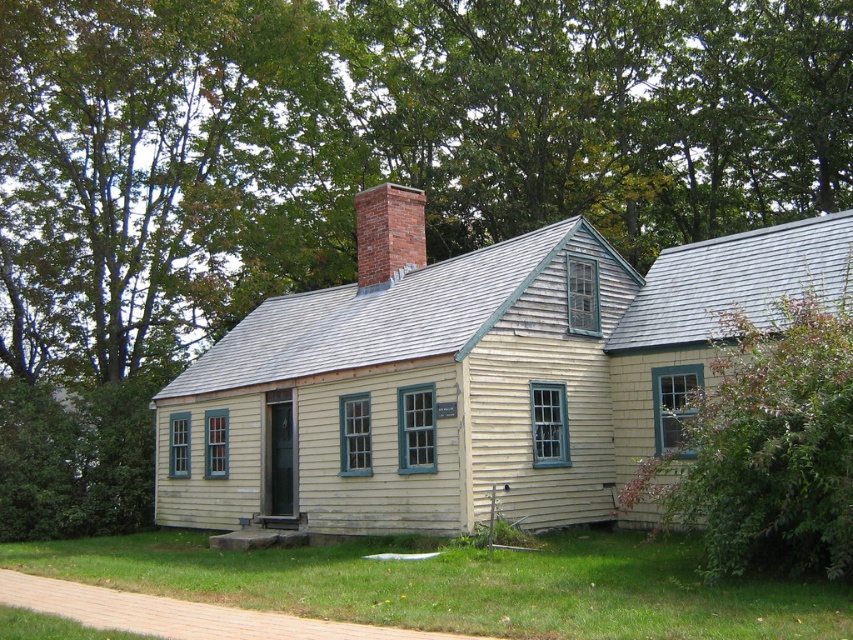
Can you confirm if green leafy bush at right is thinner than brick chimney at center?

Indeed, green leafy bush at right has a lesser width compared to brick chimney at center.

Who is more distant from viewer, (703, 472) or (363, 209)?

Point (363, 209)

Locate an element on the screen. green leafy bush at right is located at coordinates (764, 440).